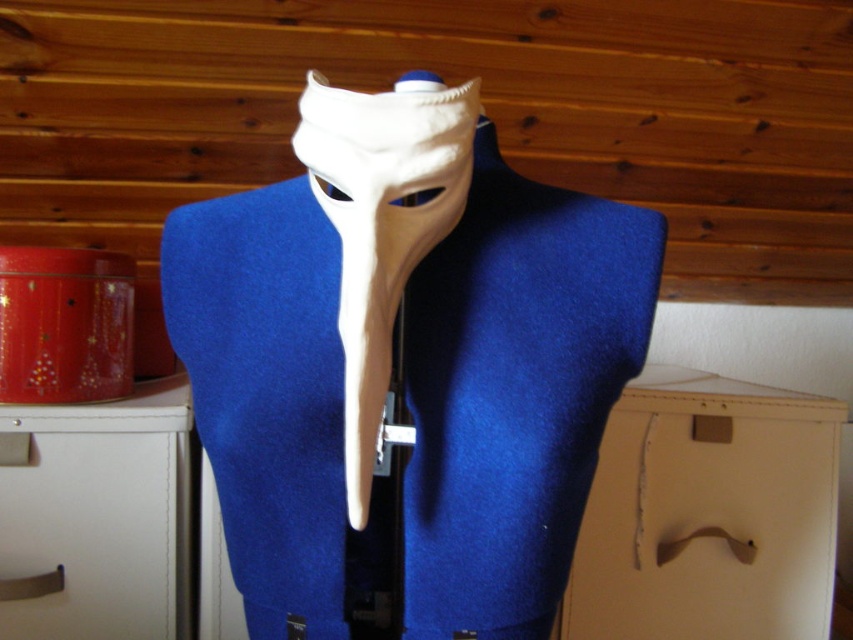
Question: Is beige cardboard drawer at lower right closer to the viewer compared to white matte mask at center?

Choices:
 (A) no
 (B) yes

Answer: (A)

Question: Which of the following is the farthest from the observer?

Choices:
 (A) (346, 348)
 (B) (70, 497)

Answer: (B)

Question: Considering the relative positions of beige cardboard drawer at lower right and white matte mask at center in the image provided, where is beige cardboard drawer at lower right located with respect to white matte mask at center?

Choices:
 (A) above
 (B) below

Answer: (B)

Question: Which of the following is the farthest from the observer?

Choices:
 (A) white matte drawer at lower left
 (B) beige cardboard drawer at lower right
 (C) blue felt jacket at center

Answer: (B)

Question: Which object is positioned closest to the white matte drawer at lower left?

Choices:
 (A) blue felt jacket at center
 (B) white matte mask at center

Answer: (A)

Question: Does blue felt jacket at center have a greater width compared to beige cardboard drawer at lower right?

Choices:
 (A) no
 (B) yes

Answer: (B)